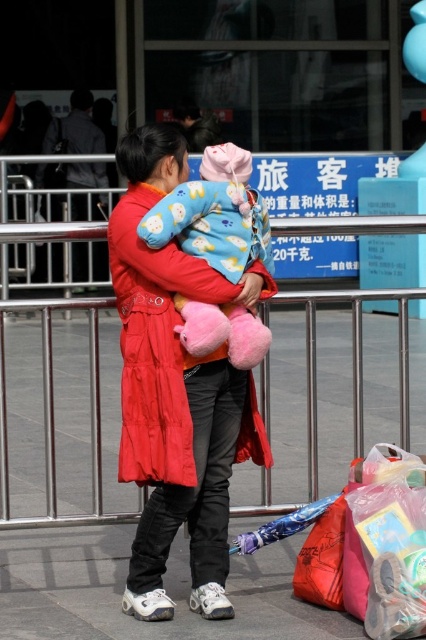
You are a parent at the park with your child. You see a metallic silver rail at center and a fluffy pink plush at center. Which object is closer to the ground?

The metallic silver rail at center is positioned under the fluffy pink plush at center, so the metallic silver rail at center is closer to the ground.

You are standing at the entrance of the transportation hub and need to reach the metallic silver rail at center to secure your luggage. Given that the rail is at coordinates point 0.659, 0.124, can you determine its position relative to the main entrance?

The metallic silver rail at center is located at point (52, 420), which means it is positioned to the right and slightly forward from the entrance based on standard coordinate systems where (0, 0) is the bottom left corner.

Looking at this image, you are a photographer trying to capture a candid shot of the woman and child in the scene. You notice the matte red coat at center and the fluffy pink plush at center. Which object is closer to the camera lens?

The matte red coat at center is positioned under the fluffy pink plush at center, meaning the fluffy pink plush at center is closer to the camera lens.